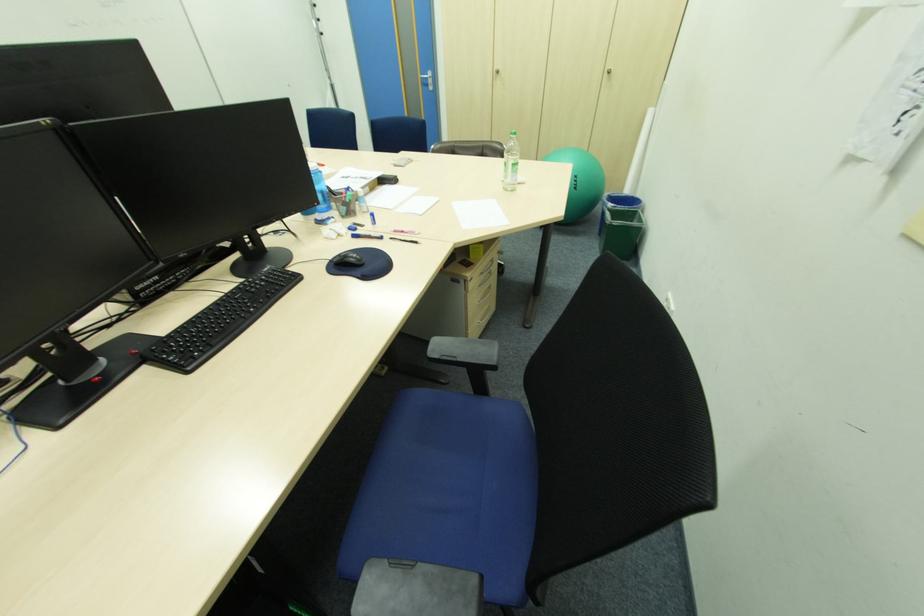
Where would you pull the drawer handle? Please return your answer as a coordinate pair (x, y).

(487, 270)